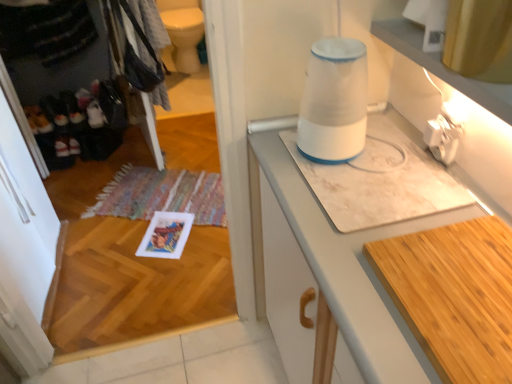
Question: From the image's perspective, is wooden cutting board at lower right on white marble countertop at center?

Choices:
 (A) no
 (B) yes

Answer: (B)

Question: Is wooden cutting board at lower right smaller than white marble countertop at center?

Choices:
 (A) yes
 (B) no

Answer: (A)

Question: Can white marble countertop at center be found inside wooden cutting board at lower right?

Choices:
 (A) no
 (B) yes

Answer: (A)

Question: Does wooden cutting board at lower right appear on the right side of white marble countertop at center?

Choices:
 (A) yes
 (B) no

Answer: (A)

Question: Are wooden cutting board at lower right and white marble countertop at center making contact?

Choices:
 (A) yes
 (B) no

Answer: (B)

Question: Visually, is white marble countertop at center positioned to the left or to the right of white plastic blender at upper center?

Choices:
 (A) right
 (B) left

Answer: (A)

Question: Is white marble countertop at center bigger or smaller than white plastic blender at upper center?

Choices:
 (A) small
 (B) big

Answer: (B)

Question: Do you think white marble countertop at center is within white plastic blender at upper center, or outside of it?

Choices:
 (A) outside
 (B) inside

Answer: (A)

Question: Is point (285, 165) closer or farther from the camera than point (337, 99)?

Choices:
 (A) closer
 (B) farther

Answer: (B)

Question: Is point (390, 251) positioned closer to the camera than point (412, 374)?

Choices:
 (A) closer
 (B) farther

Answer: (B)

Question: From a real-world perspective, is wooden cutting board at lower right positioned above or below white marble countertop at center?

Choices:
 (A) below
 (B) above

Answer: (B)

Question: From the image's perspective, is wooden cutting board at lower right located above or below white marble countertop at center?

Choices:
 (A) below
 (B) above

Answer: (B)

Question: Considering the relative positions of wooden cutting board at lower right and white marble countertop at center in the image provided, is wooden cutting board at lower right to the left or to the right of white marble countertop at center?

Choices:
 (A) left
 (B) right

Answer: (B)

Question: Is point pyautogui.click(x=221, y=198) closer or farther from the camera than point pyautogui.click(x=298, y=215)?

Choices:
 (A) farther
 (B) closer

Answer: (A)

Question: Considering the positions of multicolored woven mat at lower left and white marble countertop at center in the image, is multicolored woven mat at lower left bigger or smaller than white marble countertop at center?

Choices:
 (A) small
 (B) big

Answer: (A)